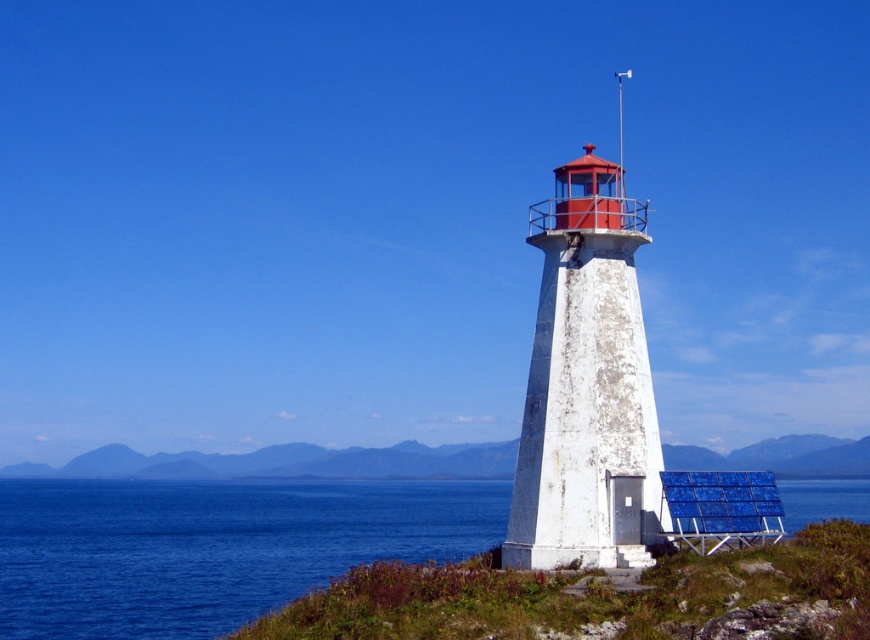
Question: Is white weathered lighthouse at center closer to the viewer compared to green grass at lower right?

Choices:
 (A) yes
 (B) no

Answer: (A)

Question: Is blue water at lower left below white weathered lighthouse at center?

Choices:
 (A) no
 (B) yes

Answer: (B)

Question: Is blue water at lower left further to camera compared to white weathered lighthouse at center?

Choices:
 (A) yes
 (B) no

Answer: (A)

Question: Which point is farther from the camera taking this photo?

Choices:
 (A) (246, 461)
 (B) (554, 198)
 (C) (486, 540)

Answer: (A)

Question: Among these objects, which one is nearest to the camera?

Choices:
 (A) blue water at lower left
 (B) white weathered lighthouse at center

Answer: (B)

Question: Which object is the closest to the blue water at lower left?

Choices:
 (A) white weathered lighthouse at center
 (B) green grass at lower right

Answer: (B)